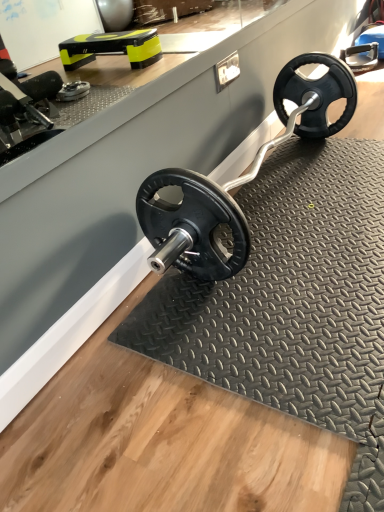
Describe the element at coordinates (235, 179) in the screenshot. This screenshot has width=384, height=512. I see `black rubber weight plate at center` at that location.

In order to click on black rubber weight plate at center in this screenshot , I will do `click(235, 179)`.

Describe the element at coordinates (293, 303) in the screenshot. I see `black rubber mat at center` at that location.

The width and height of the screenshot is (384, 512). I want to click on black rubber mat at center, so (293, 303).

The width and height of the screenshot is (384, 512). In order to click on black rubber weight plate at center in this screenshot , I will do `click(235, 179)`.

Between black rubber weight plate at center and black rubber mat at center, which one appears on the right side from the viewer's perspective?

From the viewer's perspective, black rubber mat at center appears more on the right side.

Is black rubber weight plate at center behind black rubber mat at center?

Yes.

Which is in front, point (340, 124) or point (149, 327)?

The point (149, 327) is closer to the camera.

From the image's perspective, is black rubber weight plate at center over black rubber mat at center?

Correct, black rubber weight plate at center appears higher than black rubber mat at center in the image.

From a real-world perspective, which is physically below, black rubber weight plate at center or black rubber mat at center?

From a 3D spatial view, black rubber mat at center is below.

Which object is wider, black rubber weight plate at center or black rubber mat at center?

black rubber mat at center is wider.

Between black rubber weight plate at center and black rubber mat at center, which one has more height?

black rubber weight plate at center.

Does black rubber weight plate at center have a larger size compared to black rubber mat at center?

Yes.

Is black rubber weight plate at center inside the boundaries of black rubber mat at center, or outside?

black rubber weight plate at center exists outside the volume of black rubber mat at center.

Would you say black rubber weight plate at center is a long distance from black rubber mat at center?

black rubber weight plate at center is near black rubber mat at center, not far away.

Is black rubber weight plate at center aimed at black rubber mat at center?

No, black rubber weight plate at center is not aimed at black rubber mat at center.

Measure the distance from black rubber weight plate at center to black rubber mat at center.

A distance of 8.09 inches exists between black rubber weight plate at center and black rubber mat at center.

Find the location of `mat in front of the black rubber weight plate at center`. mat in front of the black rubber weight plate at center is located at coordinates [x=293, y=303].

Between black rubber mat at center and black rubber weight plate at center, which one appears on the right side from the viewer's perspective?

black rubber mat at center.

Is black rubber mat at center in front of black rubber weight plate at center?

Yes, black rubber mat at center is closer to the viewer.

Considering the points (382, 424) and (327, 62), which point is behind, point (382, 424) or point (327, 62)?

The point (327, 62) is farther.

From the image's perspective, who appears lower, black rubber mat at center or black rubber weight plate at center?

black rubber mat at center appears lower in the image.

Looking at this image, from a real-world perspective, which object rests below the other?

black rubber mat at center, from a real-world perspective.

Considering the relative sizes of black rubber mat at center and black rubber weight plate at center in the image provided, is black rubber mat at center thinner than black rubber weight plate at center?

In fact, black rubber mat at center might be wider than black rubber weight plate at center.

Considering the sizes of objects black rubber mat at center and black rubber weight plate at center in the image provided, who is shorter, black rubber mat at center or black rubber weight plate at center?

black rubber mat at center is shorter.

Based on their sizes in the image, would you say black rubber mat at center is bigger or smaller than black rubber weight plate at center?

Considering their sizes, black rubber mat at center takes up less space than black rubber weight plate at center.

In the scene shown: Choose the correct answer: Is black rubber mat at center inside black rubber weight plate at center or outside it?

black rubber mat at center exists outside the volume of black rubber weight plate at center.

Based on the photo, is black rubber mat at center next to black rubber weight plate at center?

No, black rubber mat at center is not beside black rubber weight plate at center.

Is black rubber mat at center facing away from black rubber weight plate at center?

No, black rubber weight plate at center is not at the back of black rubber mat at center.

Can you tell me how much black rubber mat at center and black rubber weight plate at center differ in facing direction?

0.739 degrees separate the facing orientations of black rubber mat at center and black rubber weight plate at center.

In order to click on sport equipment above the black rubber mat at center (from the image's perspective) in this screenshot , I will do [235, 179].

The width and height of the screenshot is (384, 512). What are the coordinates of `sport equipment that appears above the black rubber mat at center (from the image's perspective)` in the screenshot? It's located at (235, 179).

This screenshot has width=384, height=512. I want to click on mat that is below the black rubber weight plate at center (from the image's perspective), so click(293, 303).